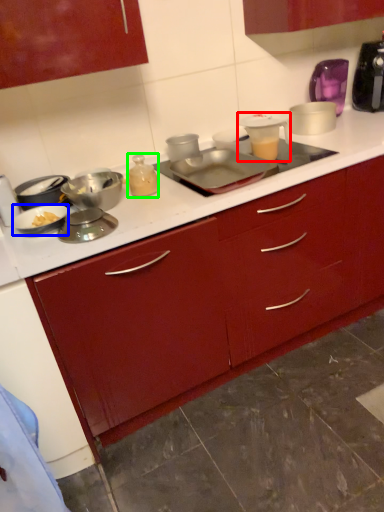
Question: Based on their relative distances, which object is farther from appliance (highlighted by a red box)? Choose from kitchen appliance (highlighted by a blue box) and bottle (highlighted by a green box).

Choices:
 (A) kitchen appliance
 (B) bottle

Answer: (A)